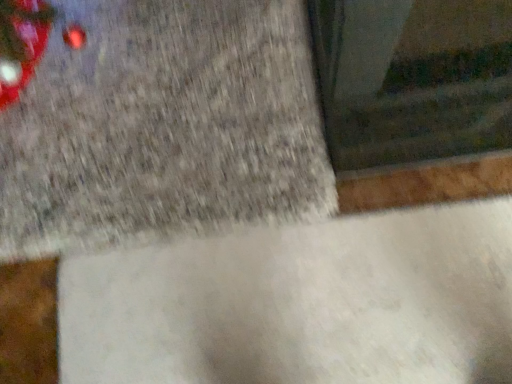
The image size is (512, 384). I want to click on free space to the back side of white matte concrete at center, which is the 2th concrete in top-to-bottom order, so click(162, 136).